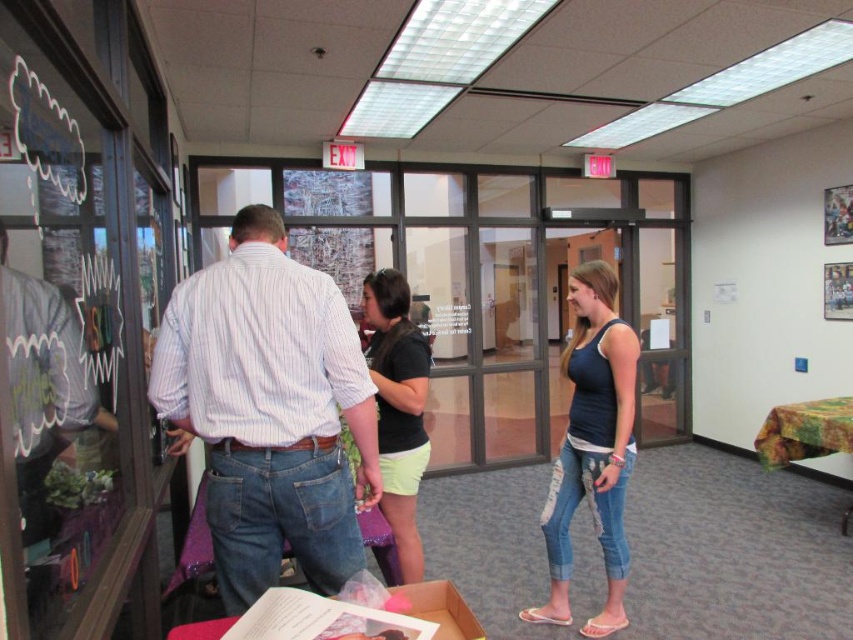
Question: Which of the following is the farthest from the observer?

Choices:
 (A) (457, 612)
 (B) (13, 380)
 (C) (344, 376)

Answer: (C)

Question: Is striped cotton shirt at center bigger than black matte shirt at center?

Choices:
 (A) yes
 (B) no

Answer: (A)

Question: Can you confirm if denim patchwork jeans at center is positioned above cardboard box at center?

Choices:
 (A) no
 (B) yes

Answer: (B)

Question: Is denim patchwork jeans at center smaller than cardboard box at center?

Choices:
 (A) yes
 (B) no

Answer: (B)

Question: Among these points, which one is farthest from the camera?

Choices:
 (A) (45, 406)
 (B) (405, 509)
 (C) (247, 417)
 (D) (611, 540)

Answer: (D)

Question: Which object is closer to the camera taking this photo?

Choices:
 (A) denim patchwork jeans at center
 (B) striped cotton shirt at center

Answer: (B)